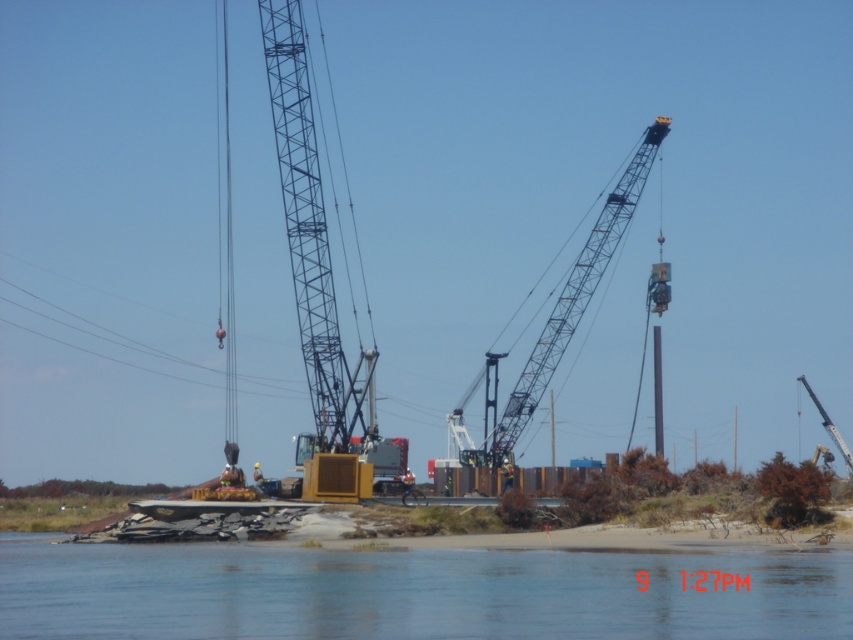
Question: Can you confirm if clear water at lower center is positioned below metallic gray crane at upper right?

Choices:
 (A) yes
 (B) no

Answer: (A)

Question: Which object is closer to the camera taking this photo?

Choices:
 (A) clear water at lower center
 (B) metallic gray crane at upper right

Answer: (A)

Question: Which of the following is the farthest from the observer?

Choices:
 (A) metallic gray crane at upper right
 (B) metallic gray crane at right

Answer: (B)

Question: Can you confirm if clear water at lower center is positioned below metallic gray crane at upper right?

Choices:
 (A) yes
 (B) no

Answer: (A)

Question: In this image, where is metallic blue crane at center located relative to metallic gray crane at upper right?

Choices:
 (A) left
 (B) right

Answer: (A)

Question: Among these points, which one is nearest to the camera?

Choices:
 (A) coord(483,460)
 (B) coord(828,429)
 (C) coord(202,628)
 (D) coord(305,291)

Answer: (C)